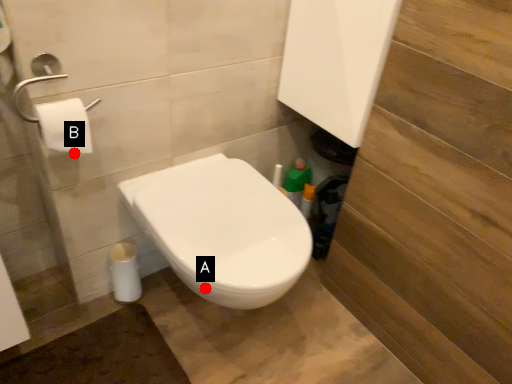
Question: Two points are circled on the image, labeled by A and B beside each circle. Among these points, which one is nearest to the camera?

Choices:
 (A) A is closer
 (B) B is closer

Answer: (A)